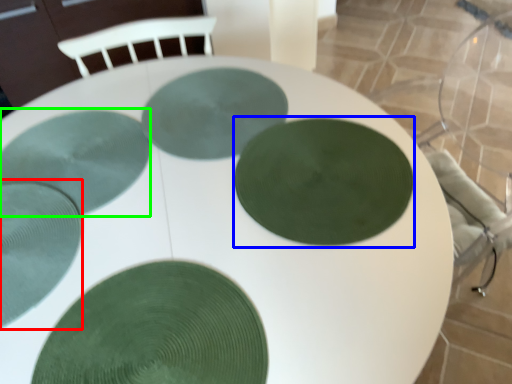
Question: Estimate the real-world distances between objects in this image. Which object is closer to glass plate (highlighted by a red box), glass plate (highlighted by a blue box) or glass plate (highlighted by a green box)?

Choices:
 (A) glass plate
 (B) glass plate

Answer: (B)